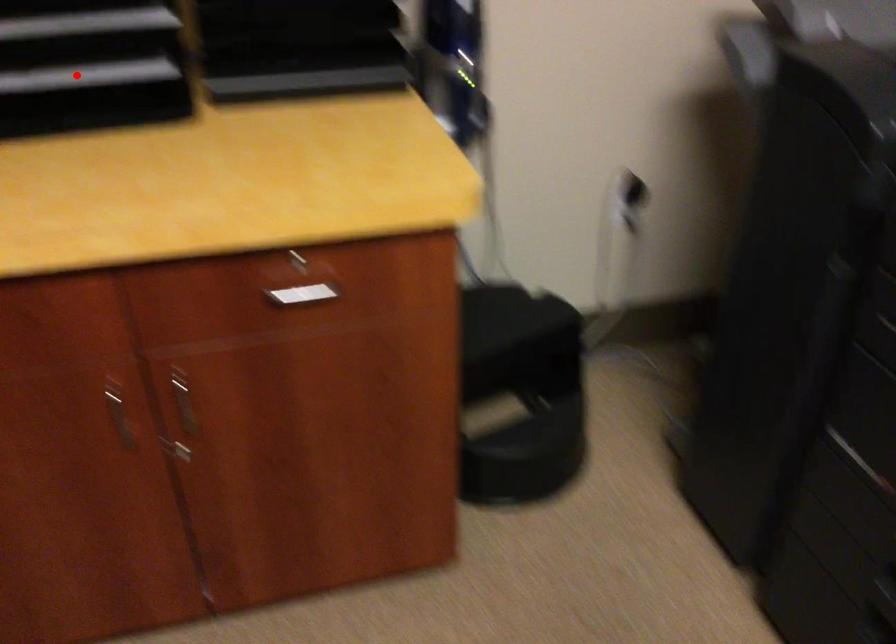
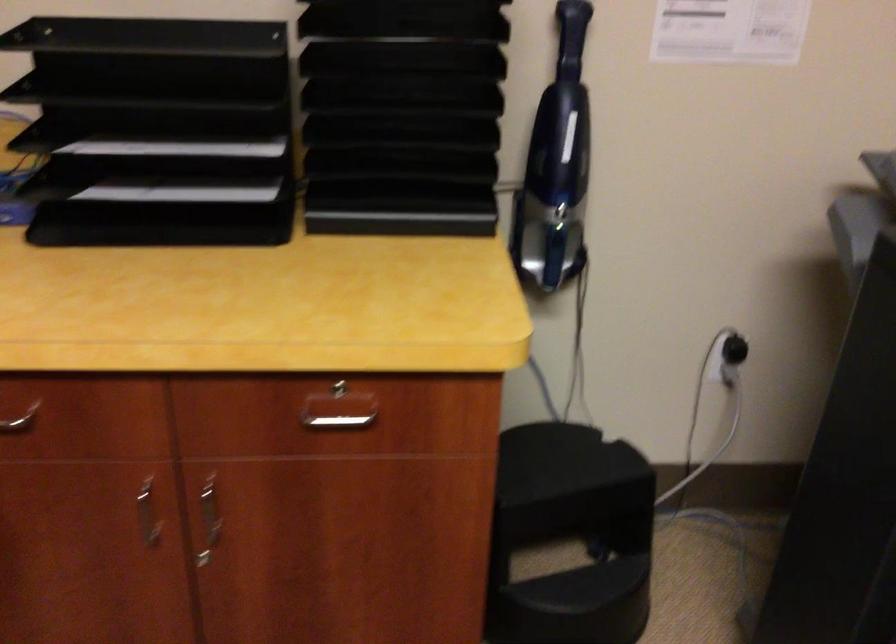
Question: I am providing you with two images of the same scene from different viewpoints. Given a red point in image1, look at the same physical point in image2. Is it:

Choices:
 (A) Closer to the viewpoint
 (B) Farther from the viewpoint

Answer: (B)